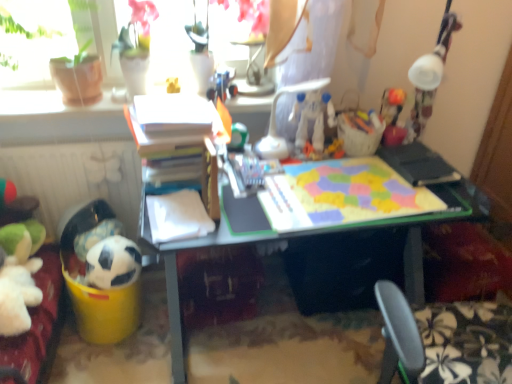
This screenshot has height=384, width=512. Find the location of `vacant space underneath white plastic chair at center (from a real-world perspective)`. vacant space underneath white plastic chair at center (from a real-world perspective) is located at coordinates (288, 167).